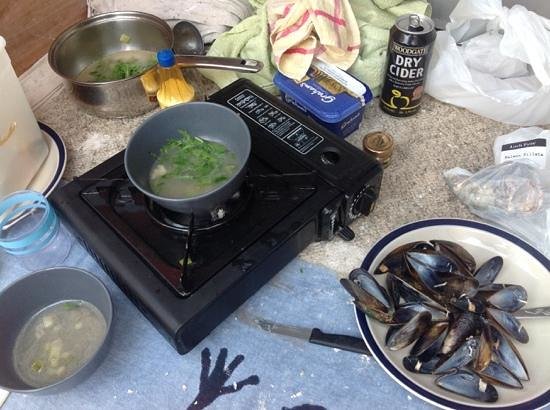
Find the location of `turn knob`. turn knob is located at coordinates (366, 200).